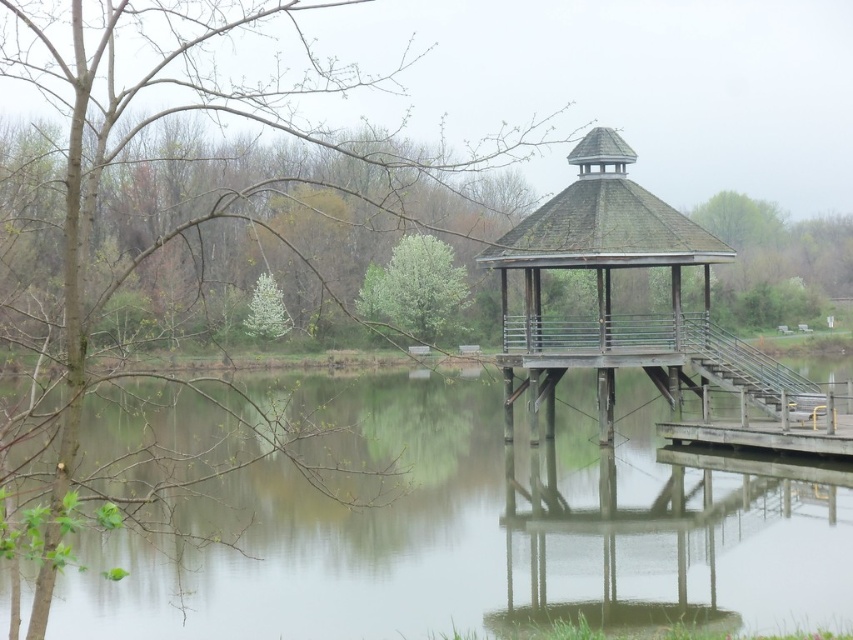
Question: Is transparent water at center thinner than green leafy tree at center?

Choices:
 (A) yes
 (B) no

Answer: (B)

Question: Which object is farther from the camera taking this photo?

Choices:
 (A) wooden stairs at lower right
 (B) green leafy tree at upper left
 (C) green leafy tree at center

Answer: (C)

Question: Which point is closer to the camera?

Choices:
 (A) green leafy tree at center
 (B) green leafy tree at upper left

Answer: (B)

Question: Which point is farther to the camera?

Choices:
 (A) wooden gazebo at center
 (B) wooden stairs at lower right

Answer: (B)

Question: Can you confirm if transparent water at center is positioned above green leafy tree at upper left?

Choices:
 (A) yes
 (B) no

Answer: (B)

Question: Does green leafy tree at upper left have a greater width compared to wooden stairs at lower right?

Choices:
 (A) no
 (B) yes

Answer: (B)